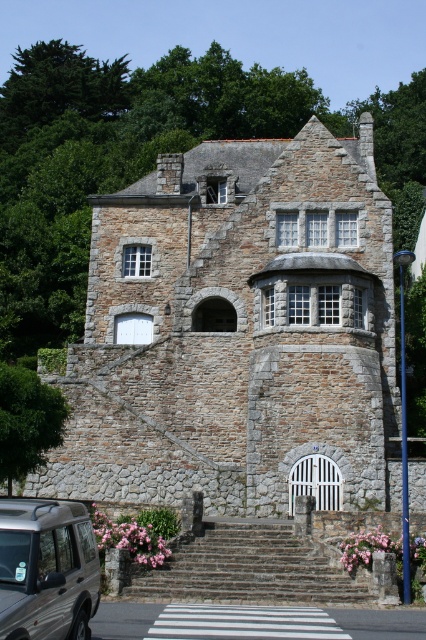
Question: Which point is farther to the camera?

Choices:
 (A) metallic silver suv at lower left
 (B) brown stone stairs at center

Answer: (B)

Question: Can you confirm if brown stone stairs at center is positioned to the right of metallic silver suv at lower left?

Choices:
 (A) yes
 (B) no

Answer: (A)

Question: Is the position of brown stone stairs at center less distant than that of metallic silver suv at lower left?

Choices:
 (A) yes
 (B) no

Answer: (B)

Question: Among these objects, which one is farthest from the camera?

Choices:
 (A) brown stone stairs at center
 (B) metallic silver suv at lower left

Answer: (A)

Question: Among these objects, which one is nearest to the camera?

Choices:
 (A) metallic silver suv at lower left
 (B) brown stone stairs at center

Answer: (A)

Question: Does brown stone stairs at center have a lesser width compared to metallic silver suv at lower left?

Choices:
 (A) no
 (B) yes

Answer: (A)